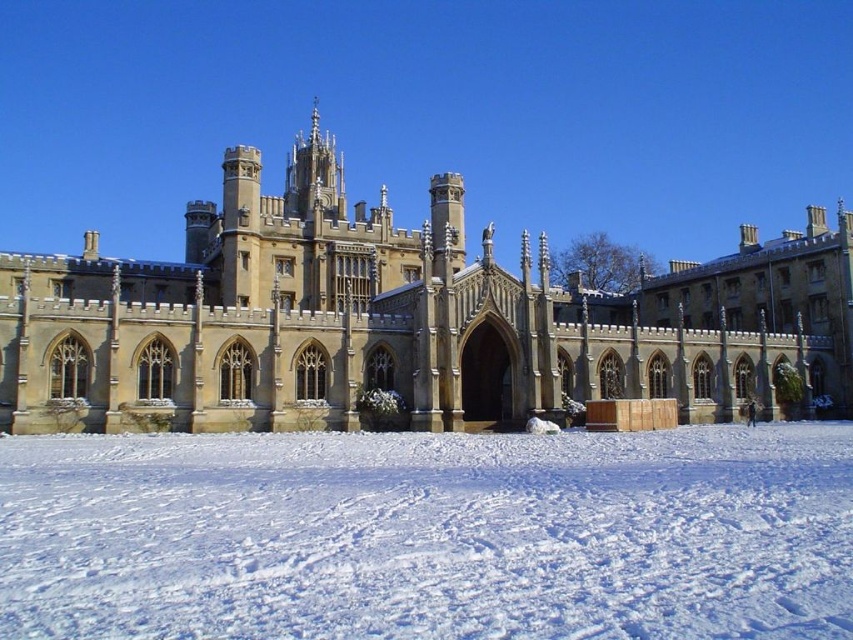
You are standing in the snow and want to walk towards the golden stone palace at center. Which direction should you move relative to the white powdery snow at lower center?

You should move to the right relative to the white powdery snow at lower center because the golden stone palace at center is on the right side of the snow.

You are standing in front of the golden stone palace at center and want to walk towards the white powdery snow at lower center. Which direction should you move?

Since the white powdery snow at lower center is closer to the viewer than the golden stone palace at center, you should move forward towards the snow, as it is in front of the palace.